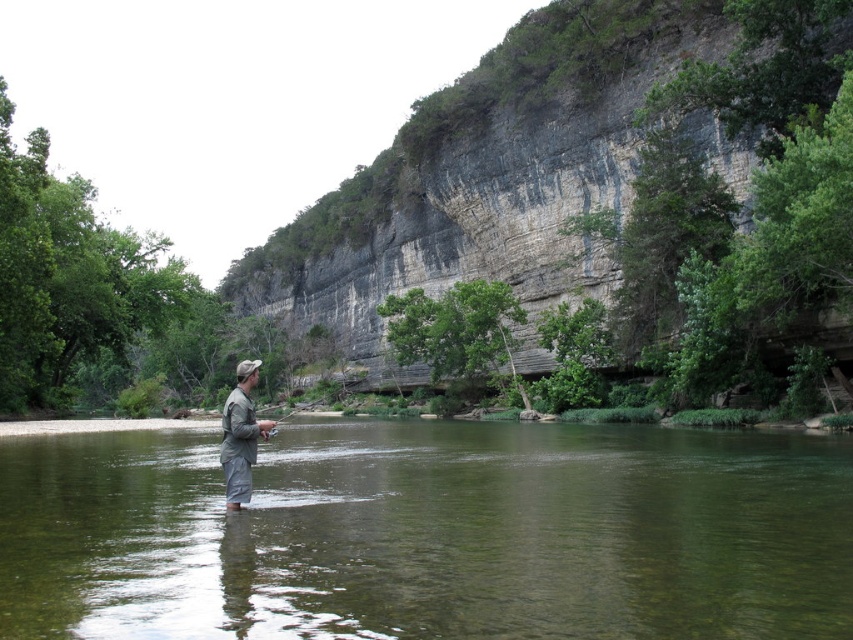
Between clear water at center and gray matte waders at center, which one has less height?

With less height is clear water at center.

Measure the distance between clear water at center and gray matte waders at center.

19.04 meters

What do you see at coordinates (430, 532) in the screenshot? This screenshot has height=640, width=853. I see `clear water at center` at bounding box center [430, 532].

In order to click on clear water at center in this screenshot , I will do `click(430, 532)`.

Is point (828, 538) closer to viewer compared to point (776, 20)?

Yes, it is.

Is clear water at center bigger than gray rock cliff at center?

No.

You are a GUI agent. You are given a task and a screenshot of the screen. Output one action in this format:
    pyautogui.click(x=<x>, y=<y>)
    Task: Click on the clear water at center
    
    Given the screenshot: What is the action you would take?
    pyautogui.click(x=430, y=532)

Measure the distance between gray rock cliff at center and camera.

A distance of 56.42 meters exists between gray rock cliff at center and camera.

Between gray rock cliff at center and gray matte waders at center, which one appears on the right side from the viewer's perspective?

gray rock cliff at center is more to the right.

The width and height of the screenshot is (853, 640). What are the coordinates of `gray rock cliff at center` in the screenshot? It's located at (544, 122).